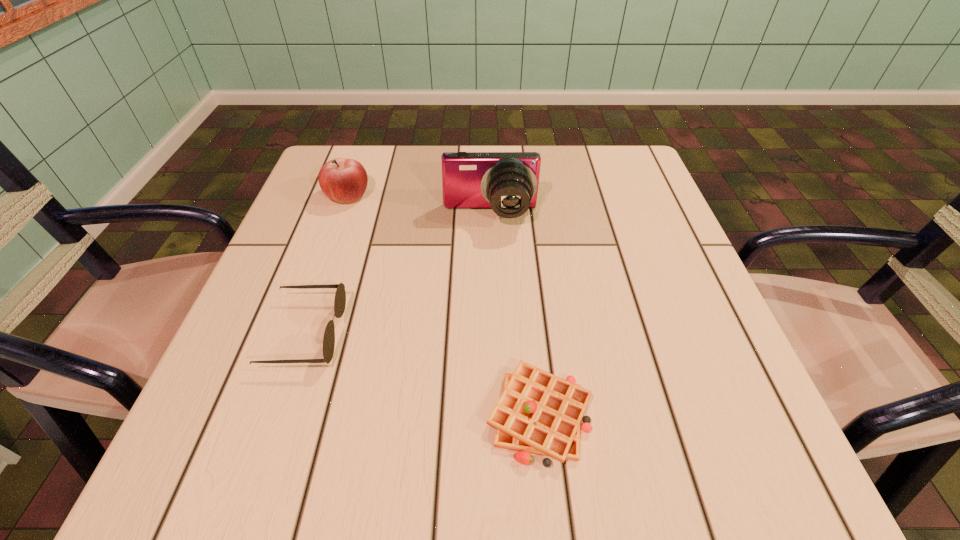
Where is `apple present at the left edge`? The image size is (960, 540). apple present at the left edge is located at coordinates (343, 180).

The image size is (960, 540). Find the location of `sunglasses that is at the left edge`. sunglasses that is at the left edge is located at coordinates (340, 296).

The width and height of the screenshot is (960, 540). I want to click on object that is at the far left corner, so click(x=343, y=180).

Image resolution: width=960 pixels, height=540 pixels. In order to click on free point at the far edge in this screenshot , I will do `click(415, 166)`.

You are a GUI agent. You are given a task and a screenshot of the screen. Output one action in this format:
    pyautogui.click(x=<x>, y=<y>)
    Task: Click on the vacant space at the near edge
    The width and height of the screenshot is (960, 540).
    Given the screenshot: What is the action you would take?
    pyautogui.click(x=306, y=471)

This screenshot has width=960, height=540. Find the location of `vacant space at the left edge`. vacant space at the left edge is located at coordinates (301, 239).

What are the coordinates of `blank space at the right edge` in the screenshot? It's located at (688, 315).

In the image, there is a desktop. Identify the location of vacant space at the far right corner. This screenshot has width=960, height=540. (647, 173).

The height and width of the screenshot is (540, 960). I want to click on free space between the waffle and the third shortest object, so click(444, 305).

Where is `vacant region between the shortest object and the tallest object`? The image size is (960, 540). vacant region between the shortest object and the tallest object is located at coordinates (515, 315).